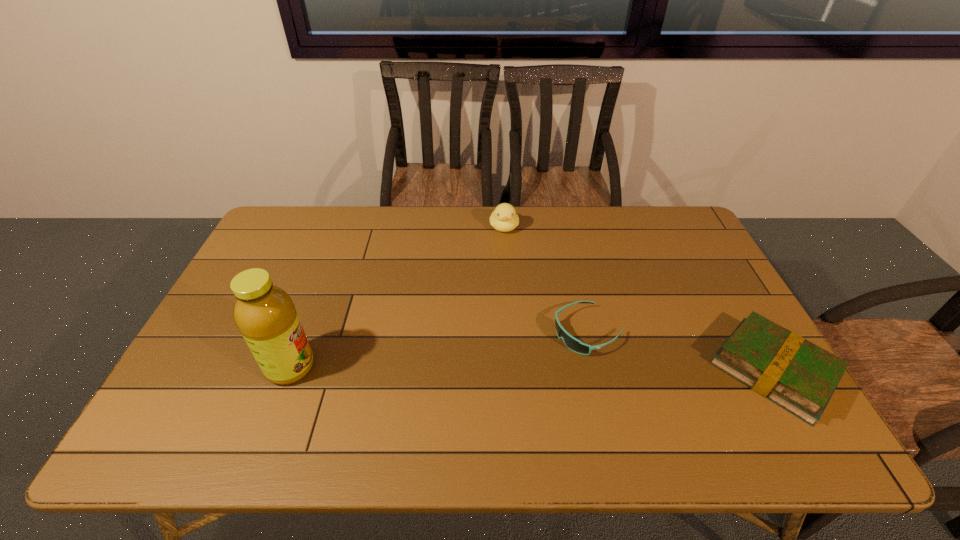
At what (x,y) coordinates should I click in order to perform the action: click on vacant spot on the desktop that is between the leftmost object and the book and is positioned at the beak of the duckling. Please return your answer as a coordinate pair (x, y). The width and height of the screenshot is (960, 540). Looking at the image, I should click on (516, 369).

The width and height of the screenshot is (960, 540). I want to click on vacant space on the desktop that is between the leftmost object and the book and is positioned on the front-facing side of the third object from left to right, so click(518, 369).